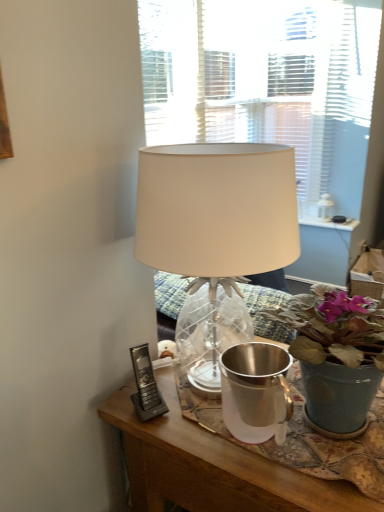
Question: Can you confirm if silver metallic watering can at center is smaller than white fabric lampshade at center?

Choices:
 (A) no
 (B) yes

Answer: (B)

Question: From a real-world perspective, is silver metallic watering can at center located beneath white fabric lampshade at center?

Choices:
 (A) yes
 (B) no

Answer: (A)

Question: Considering the relative sizes of silver metallic watering can at center and white fabric lampshade at center in the image provided, is silver metallic watering can at center bigger than white fabric lampshade at center?

Choices:
 (A) yes
 (B) no

Answer: (B)

Question: Is silver metallic watering can at center not inside white fabric lampshade at center?

Choices:
 (A) no
 (B) yes

Answer: (A)

Question: Is silver metallic watering can at center oriented towards white fabric lampshade at center?

Choices:
 (A) yes
 (B) no

Answer: (A)

Question: From the image's perspective, is silver metallic watering can at center above white fabric lampshade at center?

Choices:
 (A) yes
 (B) no

Answer: (B)

Question: Is the position of silver metallic watering can at center less distant than that of matte gray pot at center?

Choices:
 (A) yes
 (B) no

Answer: (B)

Question: From the image's perspective, is silver metallic watering can at center under matte gray pot at center?

Choices:
 (A) no
 (B) yes

Answer: (B)

Question: Can you confirm if silver metallic watering can at center is wider than matte gray pot at center?

Choices:
 (A) no
 (B) yes

Answer: (A)

Question: Are silver metallic watering can at center and matte gray pot at center beside each other?

Choices:
 (A) no
 (B) yes

Answer: (A)

Question: Is silver metallic watering can at center shorter than matte gray pot at center?

Choices:
 (A) yes
 (B) no

Answer: (A)

Question: Is matte gray pot at center completely or partially inside silver metallic watering can at center?

Choices:
 (A) yes
 (B) no

Answer: (B)

Question: Can you confirm if black plastic phone at lower left is positioned to the right of white fabric lampshade at center?

Choices:
 (A) no
 (B) yes

Answer: (A)